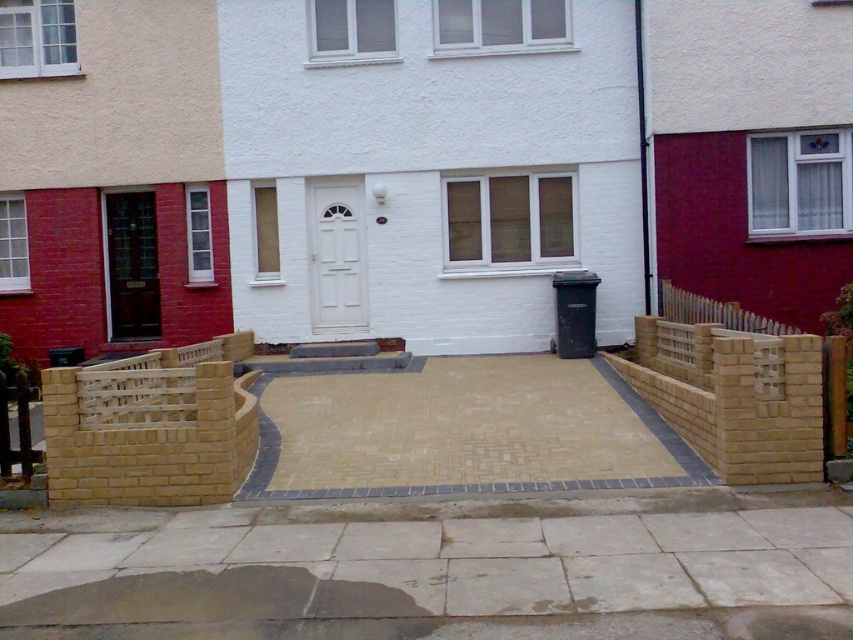
Question: Which point is farther to the camera?

Choices:
 (A) matte black door at left
 (B) white matte door at center
 (C) tan paving stones at center

Answer: (A)

Question: Can you confirm if smooth concrete pavement at center is thinner than white matte door at center?

Choices:
 (A) no
 (B) yes

Answer: (A)

Question: Which object appears closest to the camera in this image?

Choices:
 (A) white matte door at center
 (B) matte black door at left
 (C) tan paving stones at center
 (D) smooth concrete pavement at center

Answer: (D)

Question: Is tan paving stones at center smaller than white matte door at center?

Choices:
 (A) no
 (B) yes

Answer: (A)

Question: Is smooth concrete pavement at center bigger than tan paving stones at center?

Choices:
 (A) yes
 (B) no

Answer: (A)

Question: Which point is closer to the camera?

Choices:
 (A) 310,497
 (B) 397,556
 (C) 339,182
 (D) 119,305

Answer: (B)